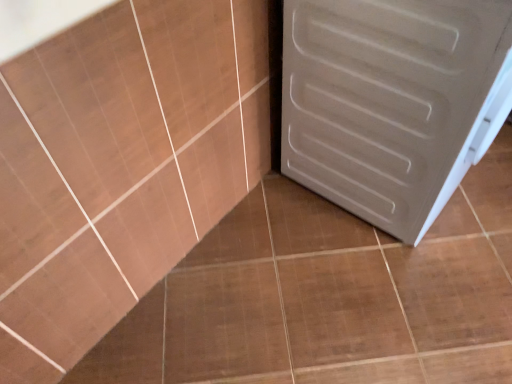
Identify the location of vacant area that lies in front of white matte door at right. (393, 285).